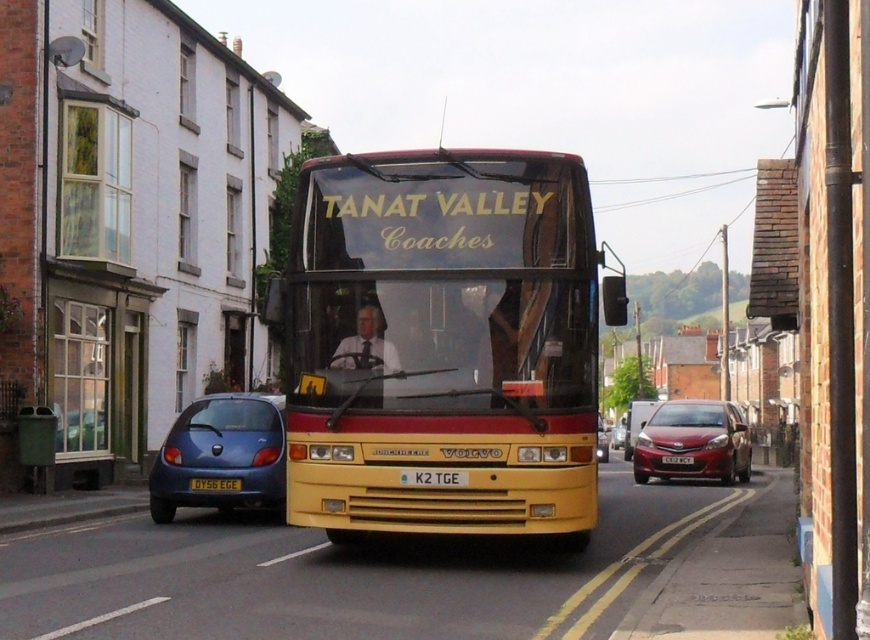
Is point (415, 264) more distant than point (206, 506)?

No, (415, 264) is in front of (206, 506).

Does yellow matte/decorative bus at center lie behind metallic blue hatchback at lower left?

No, it is in front of metallic blue hatchback at lower left.

The image size is (870, 640). Find the location of `yellow matte/decorative bus at center`. yellow matte/decorative bus at center is located at coordinates (442, 342).

Image resolution: width=870 pixels, height=640 pixels. What are the coordinates of `shiny red sedan at right` in the screenshot? It's located at (693, 442).

You are a GUI agent. You are given a task and a screenshot of the screen. Output one action in this format:
    pyautogui.click(x=<x>, y=<y>)
    Task: Click on the shiny red sedan at right
    
    Given the screenshot: What is the action you would take?
    click(693, 442)

Which is in front, point (560, 216) or point (458, 481)?

Point (458, 481)

Which is below, yellow matte/decorative bus at center or black plastic license plate at center?

black plastic license plate at center

You are a GUI agent. You are given a task and a screenshot of the screen. Output one action in this format:
    pyautogui.click(x=<x>, y=<y>)
    Task: Click on the yellow matte/decorative bus at center
    
    Given the screenshot: What is the action you would take?
    pyautogui.click(x=442, y=342)